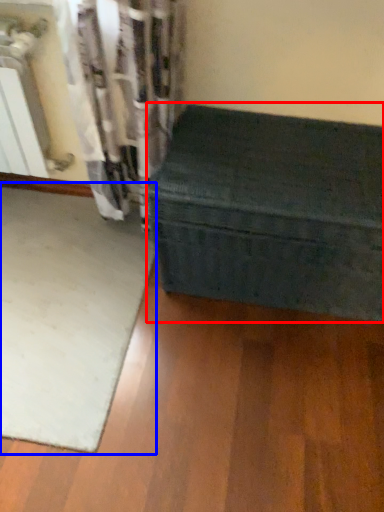
Question: Which object is further to the camera taking this photo, furniture (highlighted by a red box) or mat (highlighted by a blue box)?

Choices:
 (A) furniture
 (B) mat

Answer: (B)